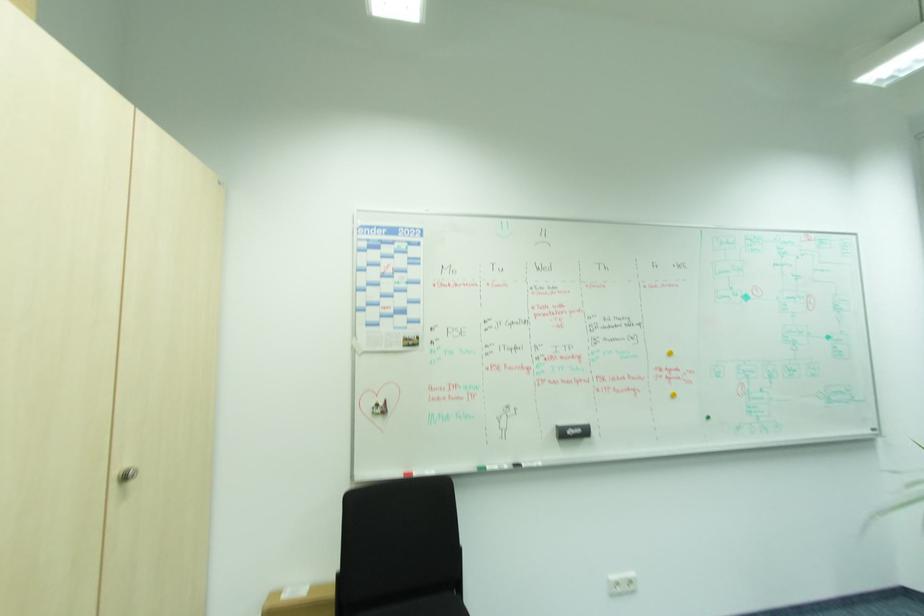
The width and height of the screenshot is (924, 616). What do you see at coordinates (415, 606) in the screenshot? I see `a chair sitting surface` at bounding box center [415, 606].